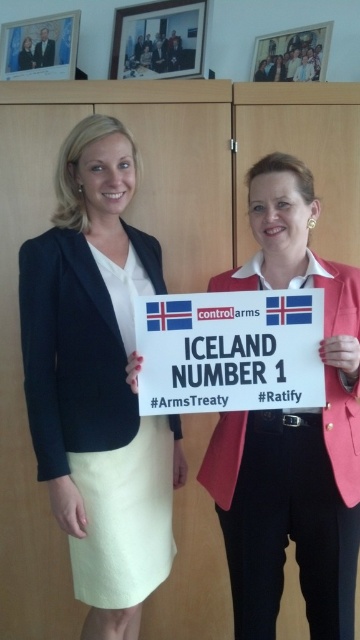
You are a photographer setting up for a shoot. You need to ensure that the matte black blazer at center and the white paper sign at center are both clearly visible in the frame. Based on their sizes, which object should you adjust your focus on first to ensure proper exposure?

The matte black blazer at center is taller than the white paper sign at center, so you should adjust your focus on the matte black blazer at center first to ensure proper exposure since it is larger and may require more attention to capture details.

You are a photographer setting up a shoot and need to ensure that the matte black blazer at center and the white paper sign at center are both visible in the frame. Based on their sizes, which object should you focus on to ensure both are in focus?

The matte black blazer at center is bigger than the white paper sign at center, so focusing on the larger object, the matte black blazer at center, will help ensure both are in focus.

Based on the photo, you are taking a photo of the two women holding the sign. You want to focus on the text at point (96, 198) and point (138, 317). Which point should you focus on first to ensure both are in focus?

You should focus on point (96, 198) first because it is closer to the camera than point (138, 317). By focusing on the closer point, the depth of field will likely include the farther point as well.